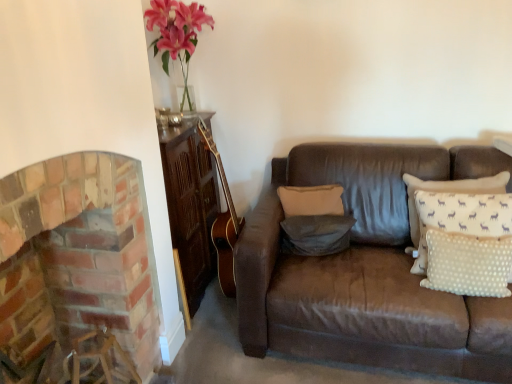
Question: From the image's perspective, is beige fabric pillow at center, placed as the 1th pillow when sorted from back to front, on top of brick fireplace at left?

Choices:
 (A) no
 (B) yes

Answer: (B)

Question: Considering the relative positions of beige fabric pillow at center, placed as the 1th pillow when sorted from back to front, and brick fireplace at left in the image provided, is beige fabric pillow at center, placed as the 1th pillow when sorted from back to front, behind brick fireplace at left?

Choices:
 (A) yes
 (B) no

Answer: (A)

Question: Is beige fabric pillow at center, which is the third pillow from front to back, beside brick fireplace at left?

Choices:
 (A) yes
 (B) no

Answer: (B)

Question: Is beige fabric pillow at center, which is the third pillow from front to back, at the left side of brick fireplace at left?

Choices:
 (A) yes
 (B) no

Answer: (B)

Question: Does beige fabric pillow at center, placed as the 1th pillow when sorted from back to front, turn towards brick fireplace at left?

Choices:
 (A) yes
 (B) no

Answer: (B)

Question: Is white dotted fabric pillow at right, the 3th pillow viewed from the back, with gray fabric pillow at center, the 2th pillow in the back-to-front sequence?

Choices:
 (A) yes
 (B) no

Answer: (B)

Question: Is white dotted fabric pillow at right, marked as the 1th pillow in a front-to-back arrangement, thinner than gray fabric pillow at center, the 2th pillow in the back-to-front sequence?

Choices:
 (A) no
 (B) yes

Answer: (B)

Question: Does white dotted fabric pillow at right, the 3th pillow viewed from the back, lie in front of gray fabric pillow at center, the 2th pillow in the back-to-front sequence?

Choices:
 (A) no
 (B) yes

Answer: (B)

Question: From the image's perspective, is white dotted fabric pillow at right, the 3th pillow viewed from the back, on top of gray fabric pillow at center, placed as the second pillow when sorted from front to back?

Choices:
 (A) yes
 (B) no

Answer: (B)

Question: Is white dotted fabric pillow at right, marked as the 1th pillow in a front-to-back arrangement, taller than gray fabric pillow at center, placed as the second pillow when sorted from front to back?

Choices:
 (A) no
 (B) yes

Answer: (B)

Question: Considering the relative sizes of white dotted fabric pillow at right, the 3th pillow viewed from the back, and gray fabric pillow at center, the 2th pillow in the back-to-front sequence, in the image provided, is white dotted fabric pillow at right, the 3th pillow viewed from the back, shorter than gray fabric pillow at center, the 2th pillow in the back-to-front sequence,?

Choices:
 (A) yes
 (B) no

Answer: (B)

Question: From the image's perspective, does white dotted fabric pillow at right, the 3th pillow viewed from the back, appear higher than beige fabric pillow at center, which is the third pillow from front to back?

Choices:
 (A) no
 (B) yes

Answer: (A)